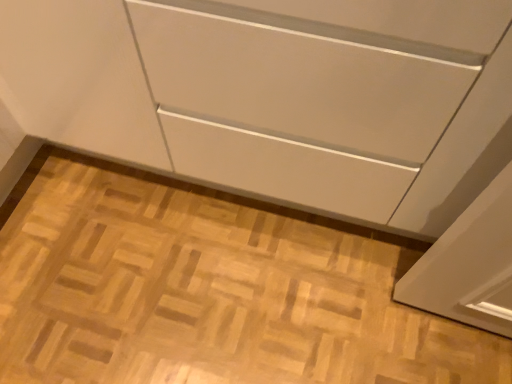
Question: In terms of height, does matte white cabinet at center look taller or shorter compared to white glossy cabinet at center?

Choices:
 (A) tall
 (B) short

Answer: (B)

Question: In the image, is matte white cabinet at center on the left side or the right side of white glossy cabinet at center?

Choices:
 (A) right
 (B) left

Answer: (A)

Question: Would you say matte white cabinet at center is inside or outside white glossy cabinet at center?

Choices:
 (A) inside
 (B) outside

Answer: (B)

Question: From a real-world perspective, is white glossy cabinet at center above or below matte white cabinet at center?

Choices:
 (A) above
 (B) below

Answer: (A)

Question: Is white glossy cabinet at center inside or outside of matte white cabinet at center?

Choices:
 (A) outside
 (B) inside

Answer: (A)

Question: Based on their positions, is white glossy cabinet at center located to the left or right of matte white cabinet at center?

Choices:
 (A) right
 (B) left

Answer: (B)

Question: From their relative heights in the image, would you say white glossy cabinet at center is taller or shorter than matte white cabinet at center?

Choices:
 (A) short
 (B) tall

Answer: (B)